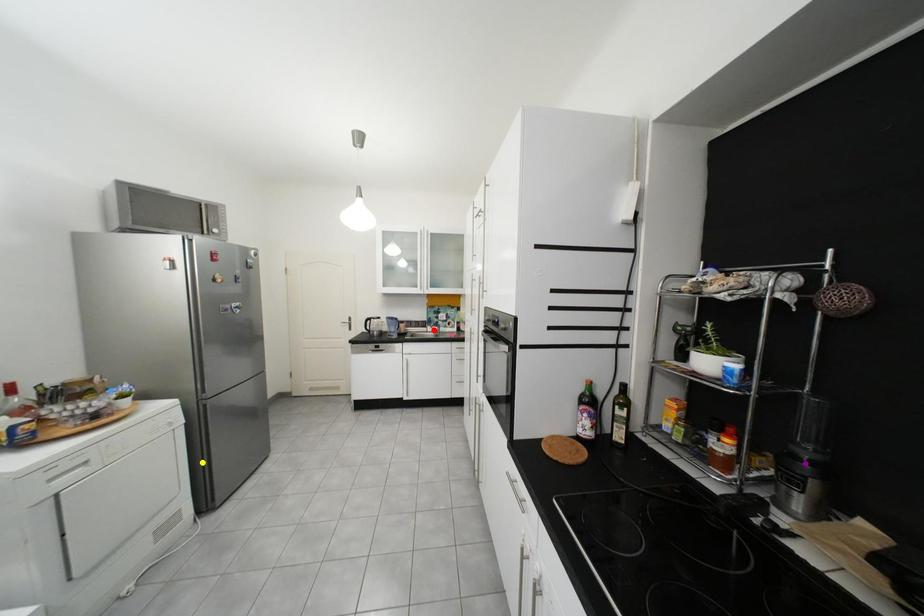
Order these from nearest to farthest:
A) red point
B) purple point
C) yellow point

purple point
yellow point
red point